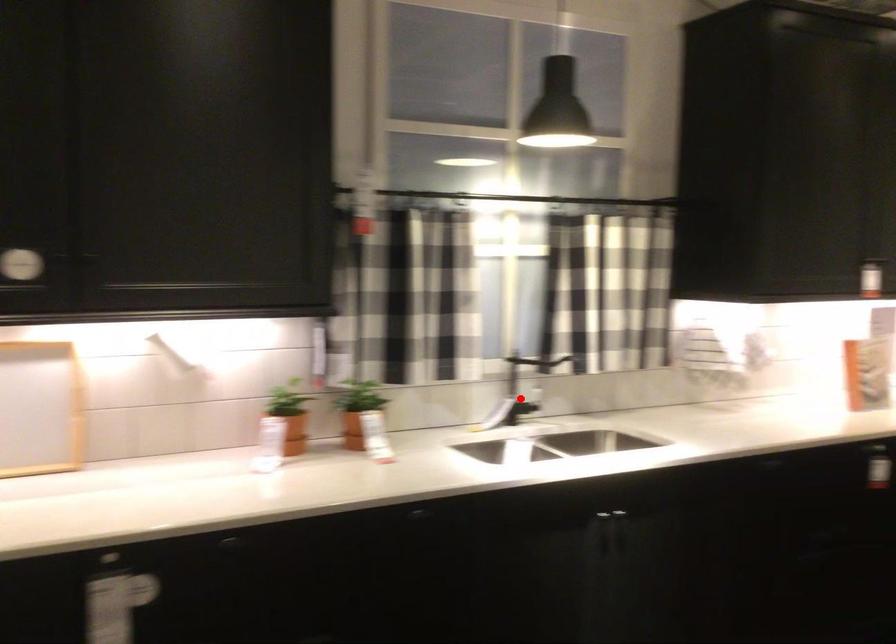
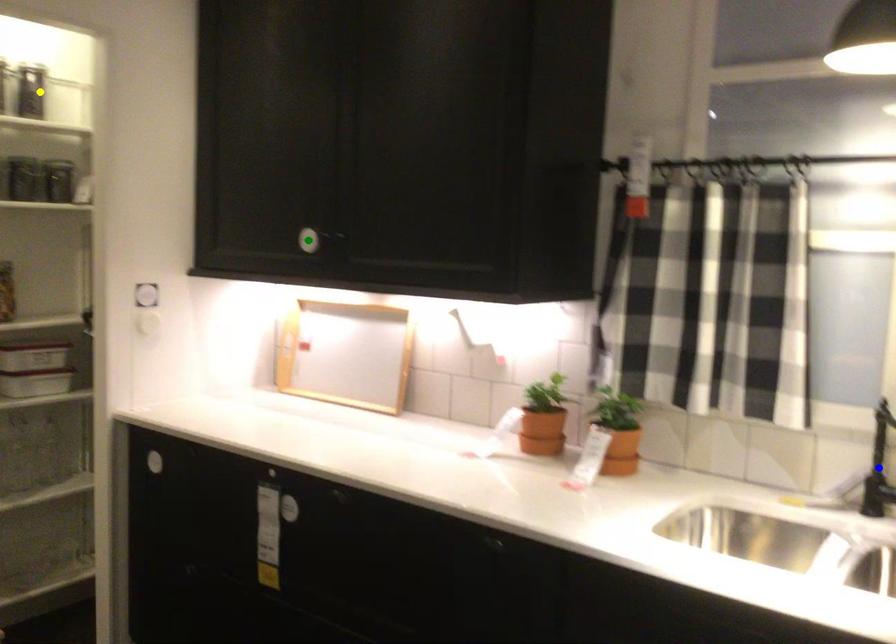
Question: I am providing you with two images of the same scene from different viewpoints. A red point is marked on the first image. You are given multiple points on the second image. Can you choose the point in image 2 that corresponds to the point in image 1?

Choices:
 (A) yellow point
 (B) blue point
 (C) green point

Answer: (B)